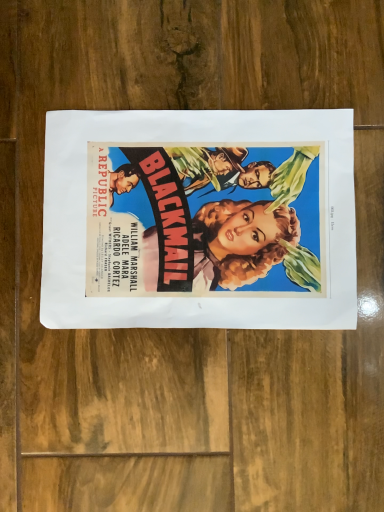
What are the coordinates of `blank space above matte paper poster at center (from a real-world perspective)` in the screenshot? It's located at (200, 212).